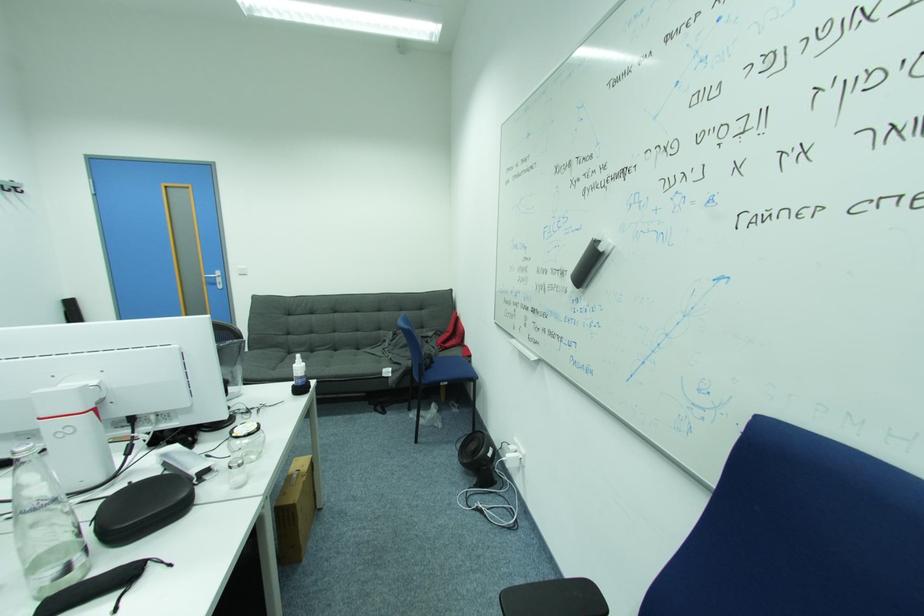
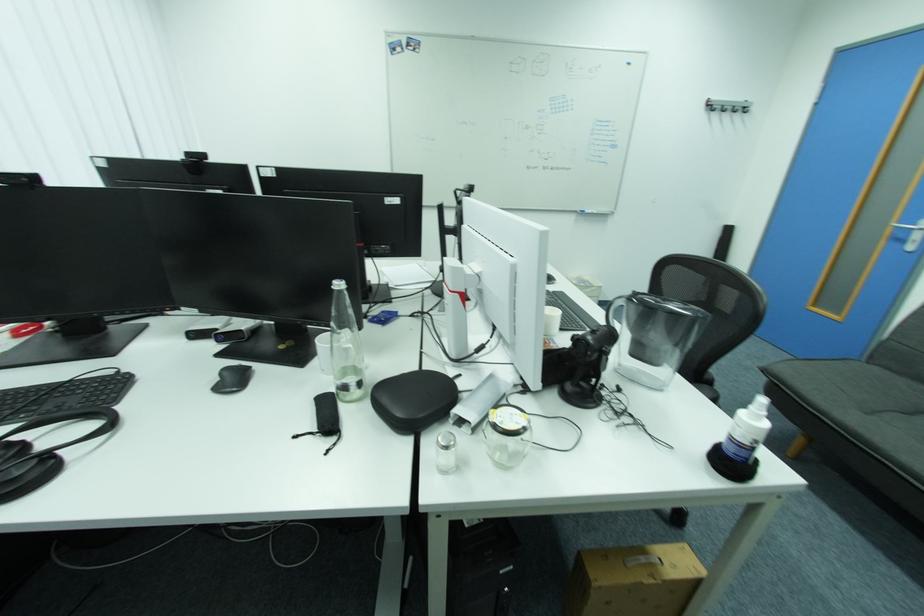
Locate, in the second image, the point that corresponds to (x=288, y=362) in the first image.

(917, 415)